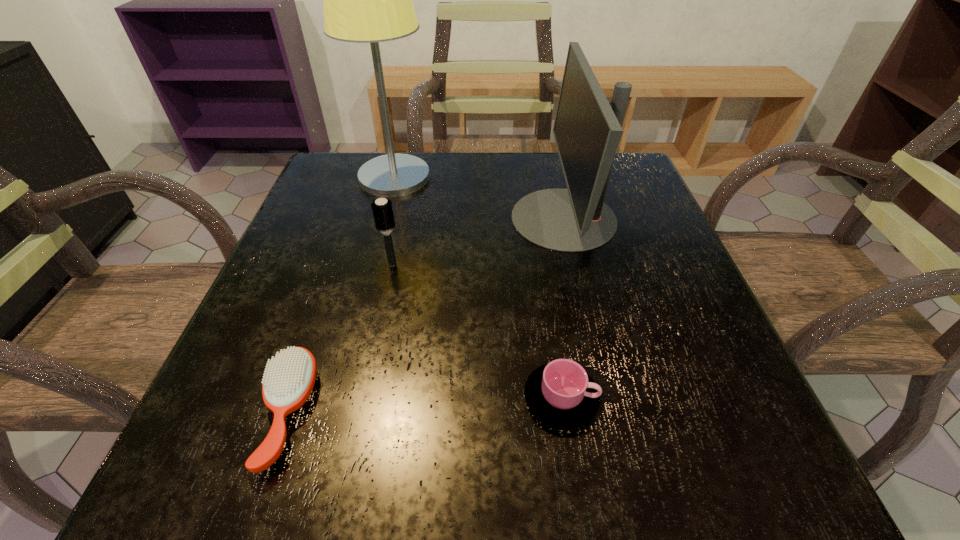
Find the location of a particular element. Image resolution: width=960 pixels, height=540 pixels. blank space located on the screen of the computer monitor is located at coordinates coord(488,218).

This screenshot has width=960, height=540. I want to click on free space located 0.360m on the front of the farther hairbrush, so click(x=349, y=470).

You are a GUI agent. You are given a task and a screenshot of the screen. Output one action in this format:
    pyautogui.click(x=<x>, y=<y>)
    Task: Click on the vacant space located 0.210m on the side with the handle of the cup
    The height and width of the screenshot is (540, 960).
    Given the screenshot: What is the action you would take?
    pyautogui.click(x=749, y=399)

The image size is (960, 540). What are the coordinates of `vacant space located 0.080m on the left of the shorter hairbrush` in the screenshot? It's located at (202, 413).

I want to click on table lamp located in the far edge section of the desktop, so click(366, 0).

The width and height of the screenshot is (960, 540). In order to click on computer monitor that is at the far edge in this screenshot , I will do `click(587, 130)`.

Find the location of a particular element. cup that is at the near edge is located at coordinates (561, 394).

The image size is (960, 540). Identify the location of hairbrush that is at the near edge. (289, 378).

What are the coordinates of `table lamp at the left edge` in the screenshot? It's located at (366, 0).

Locate an element on the screen. hairbrush present at the left edge is located at coordinates (289, 378).